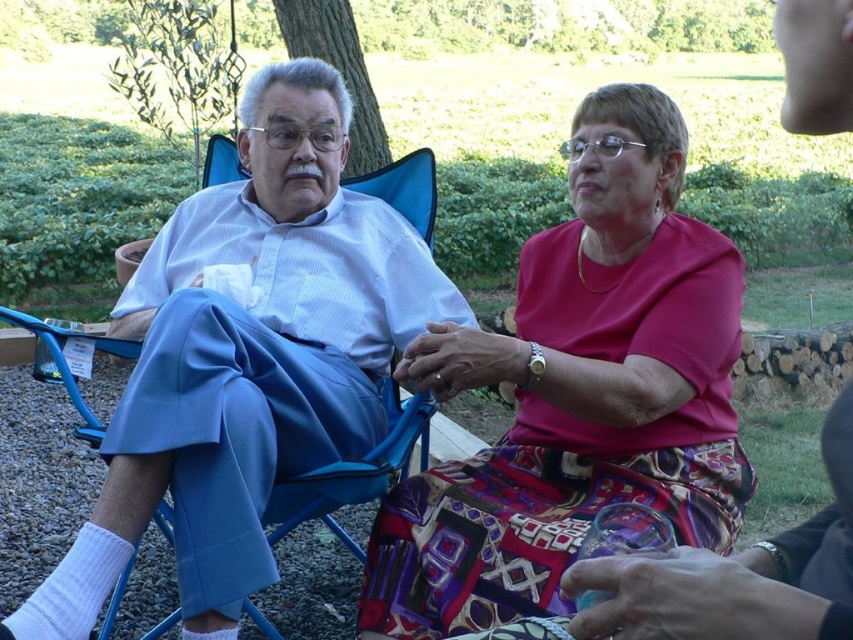
Question: Considering the relative positions of matte pink blouse at center and matte blue pants at left in the image provided, where is matte pink blouse at center located with respect to matte blue pants at left?

Choices:
 (A) right
 (B) left

Answer: (A)

Question: Does matte pink blouse at center appear under matte blue pants at left?

Choices:
 (A) no
 (B) yes

Answer: (B)

Question: Which point appears closest to the camera in this image?

Choices:
 (A) (289, 209)
 (B) (614, 157)

Answer: (B)

Question: Does matte pink blouse at center have a larger size compared to matte blue pants at left?

Choices:
 (A) no
 (B) yes

Answer: (A)

Question: Which point is farther to the camera?

Choices:
 (A) matte pink blouse at center
 (B) matte blue pants at left

Answer: (A)